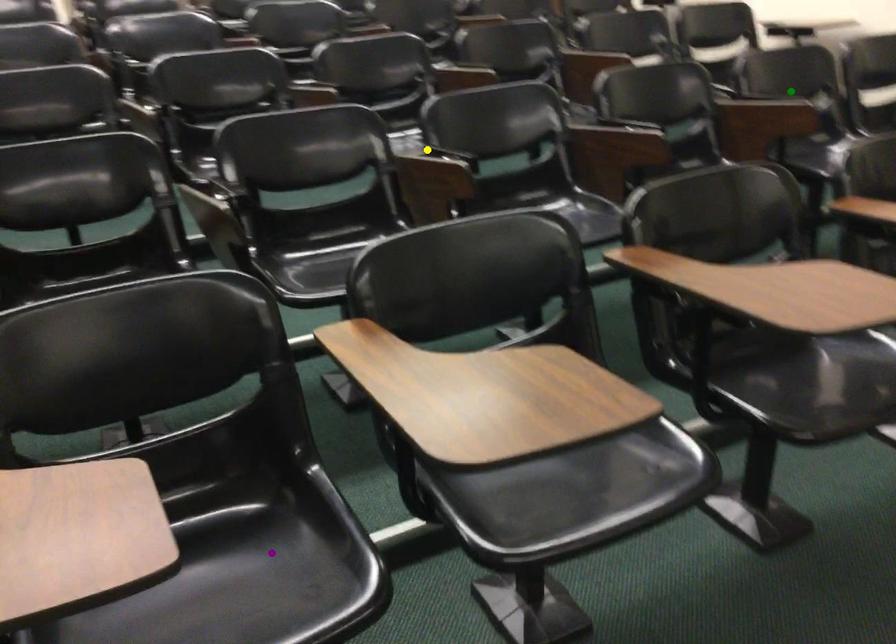
Order these from nearest to farthest:
A) purple point
B) green point
C) yellow point

purple point
yellow point
green point